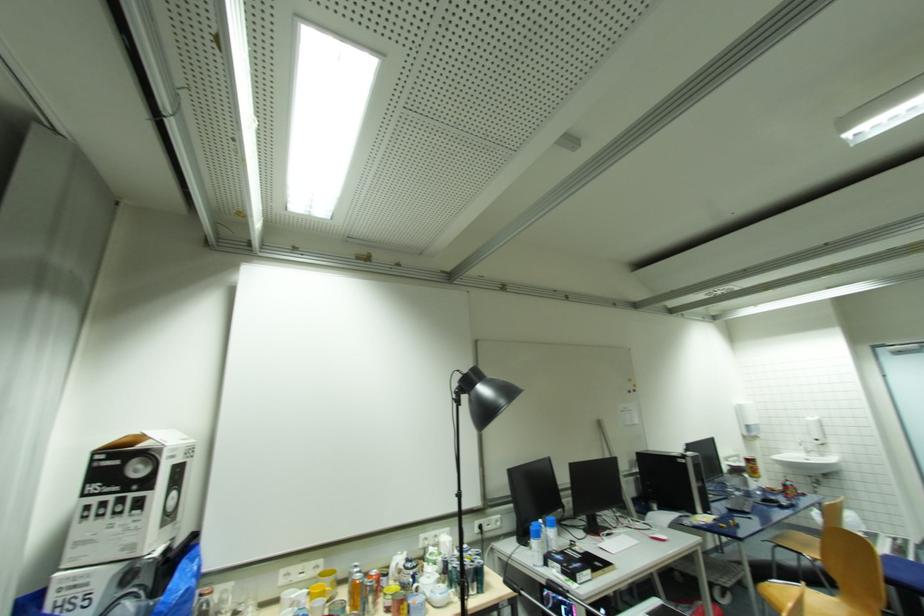
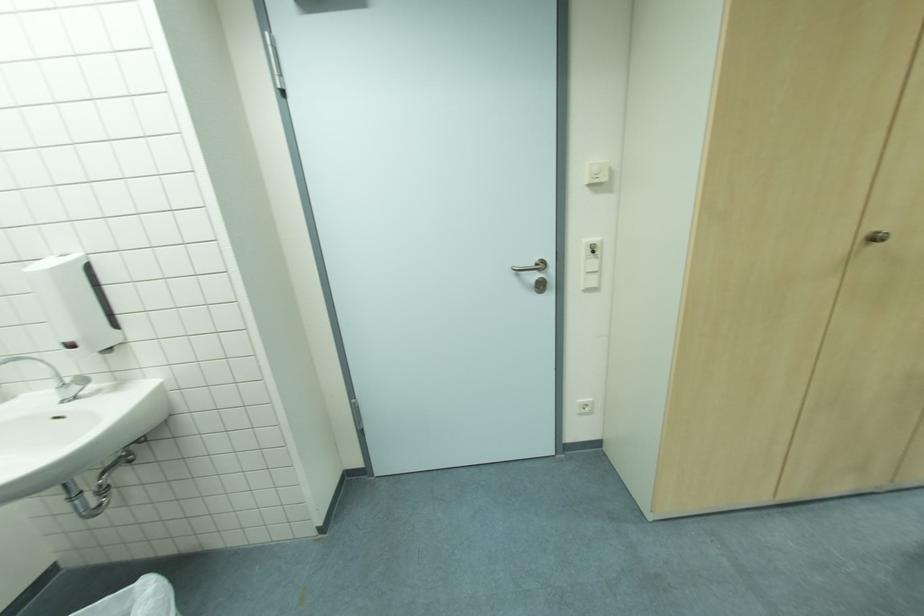
Where in the second image is the point corresponding to the point at 820,439 from the first image?

(71, 341)